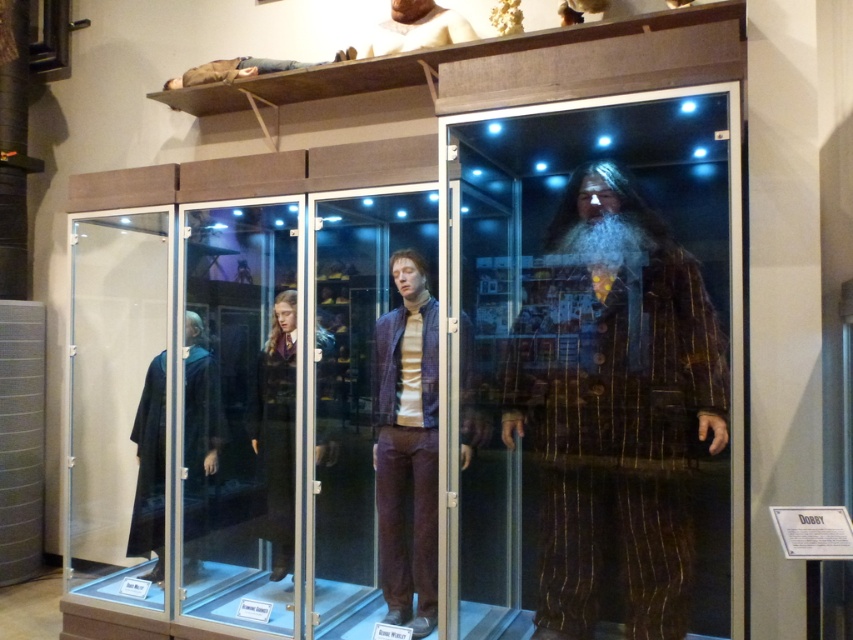
Which is below, brown striped suit at center or dark blue velvet robe at left?

dark blue velvet robe at left is below.

Is point (659, 396) positioned before point (190, 532)?

Yes, point (659, 396) is closer to viewer.

Where is `brown striped suit at center`? This screenshot has height=640, width=853. brown striped suit at center is located at coordinates (614, 406).

Find the location of `brown striped suit at center`. brown striped suit at center is located at coordinates 614,406.

In the scene shown: Is brown striped suit at center shorter than purple matte suit at center?

In fact, brown striped suit at center may be taller than purple matte suit at center.

The width and height of the screenshot is (853, 640). What are the coordinates of `brown striped suit at center` in the screenshot? It's located at (614, 406).

Can you confirm if purple matte suit at center is positioned below dark blue velvet robe at left?

Actually, purple matte suit at center is above dark blue velvet robe at left.

Between point (437, 499) and point (204, 522), which one is positioned behind?

The point (204, 522) is behind.

Where is `purple matte suit at center`? The height and width of the screenshot is (640, 853). purple matte suit at center is located at coordinates (407, 445).